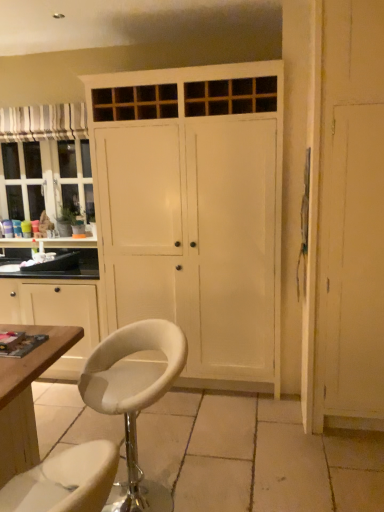
Find the location of a particular element. Image resolution: width=384 pixels, height=512 pixels. vacant position to the left of wooden screen door at right is located at coordinates (278, 428).